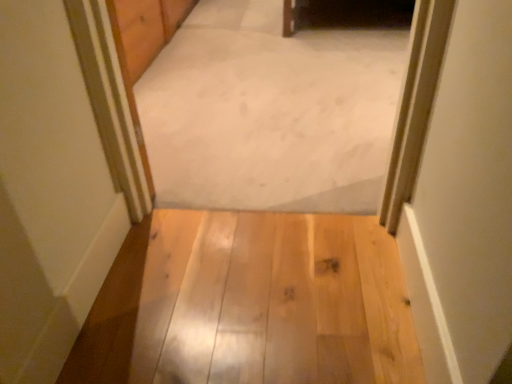
Question: In the image, is light wood floor at center positioned in front of or behind white carpet at center?

Choices:
 (A) behind
 (B) front

Answer: (B)

Question: In the image, is light wood floor at center on the left side or the right side of white carpet at center?

Choices:
 (A) left
 (B) right

Answer: (A)

Question: From the image's perspective, relative to white carpet at center, is light wood floor at center above or below?

Choices:
 (A) above
 (B) below

Answer: (B)

Question: Is white carpet at center spatially inside light wood floor at center, or outside of it?

Choices:
 (A) inside
 (B) outside

Answer: (B)

Question: From a real-world perspective, is white carpet at center positioned above or below light wood floor at center?

Choices:
 (A) above
 (B) below

Answer: (B)

Question: Considering the positions of white carpet at center and light wood floor at center in the image, is white carpet at center bigger or smaller than light wood floor at center?

Choices:
 (A) big
 (B) small

Answer: (A)

Question: Considering the positions of white carpet at center and light wood floor at center in the image, is white carpet at center taller or shorter than light wood floor at center?

Choices:
 (A) tall
 (B) short

Answer: (A)